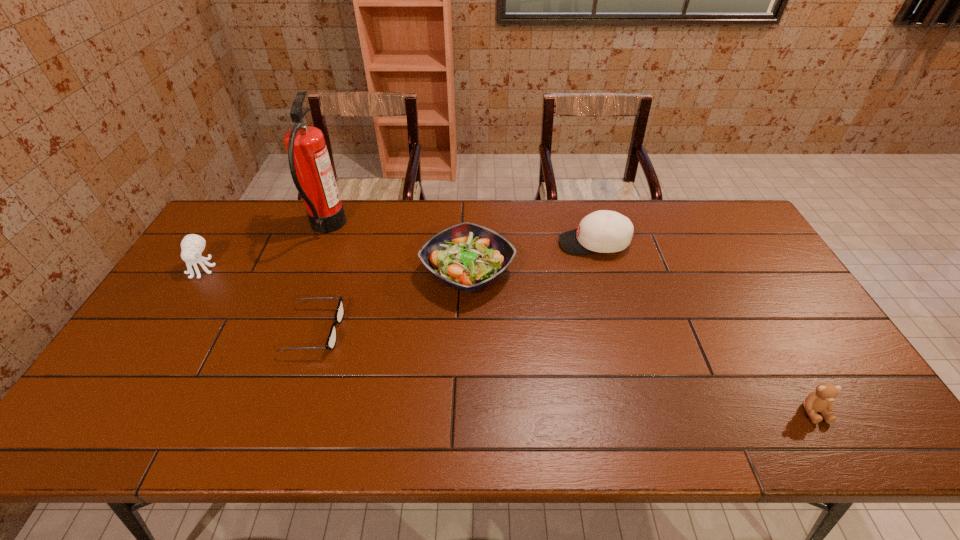
Where is `vacant space located on the front-facing side of the second object from right to left`? Image resolution: width=960 pixels, height=540 pixels. vacant space located on the front-facing side of the second object from right to left is located at coordinates (486, 244).

You are a GUI agent. You are given a task and a screenshot of the screen. Output one action in this format:
    pyautogui.click(x=<x>, y=<y>)
    Task: Click on the vacant space located 0.050m on the front-facing side of the leftmost object
    The height and width of the screenshot is (540, 960).
    Given the screenshot: What is the action you would take?
    pyautogui.click(x=187, y=292)

Locate an element on the screen. The height and width of the screenshot is (540, 960). vacant area located on the back of the salad plate is located at coordinates (469, 206).

The width and height of the screenshot is (960, 540). Identify the location of free location located on the front-facing side of the shortest object. click(x=400, y=330).

Where is `fire extinguisher present at the far edge`? fire extinguisher present at the far edge is located at coordinates (311, 170).

Identify the location of baseball cap that is at the far edge. (603, 231).

Locate an element on the screen. salad plate present at the far edge is located at coordinates (468, 257).

I want to click on object that is at the near edge, so click(821, 400).

Identify the location of object that is at the left edge. Image resolution: width=960 pixels, height=540 pixels. (192, 245).

Identify the location of object present at the right edge. The width and height of the screenshot is (960, 540). (821, 400).